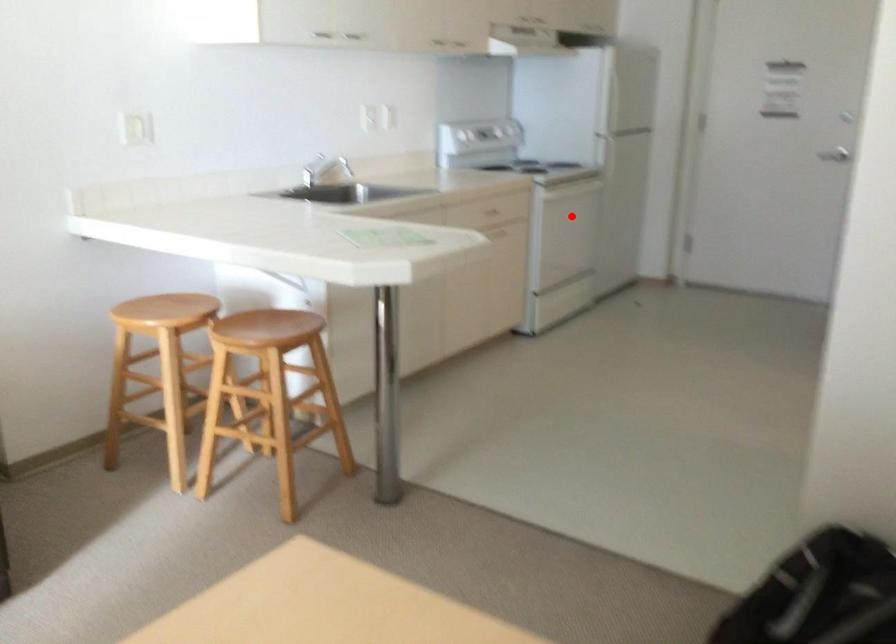
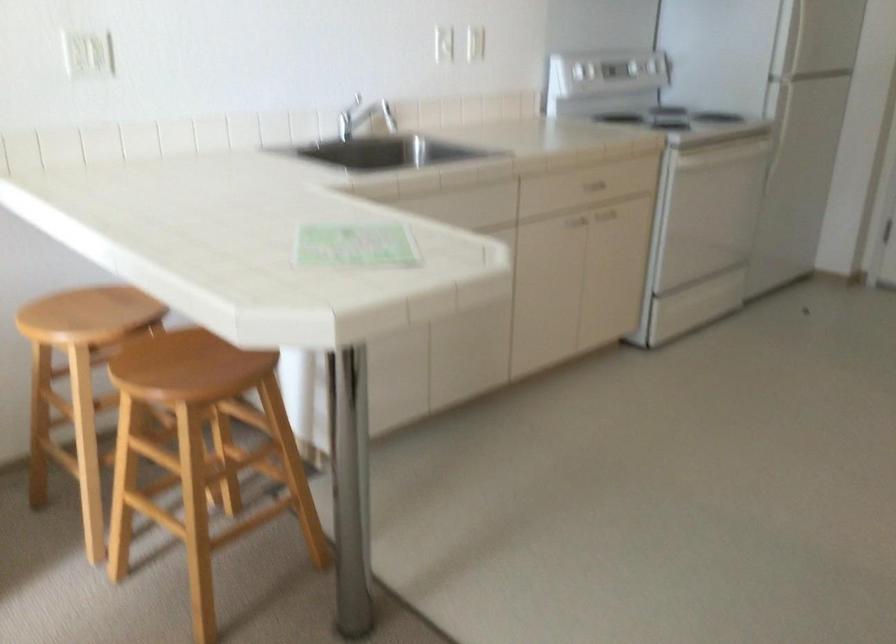
Question: I am providing you with two images of the same scene from different viewpoints. A red point is shown in image1. For the corresponding object point in image2, is it positioned nearer or farther from the camera?

Choices:
 (A) Nearer
 (B) Farther

Answer: (A)